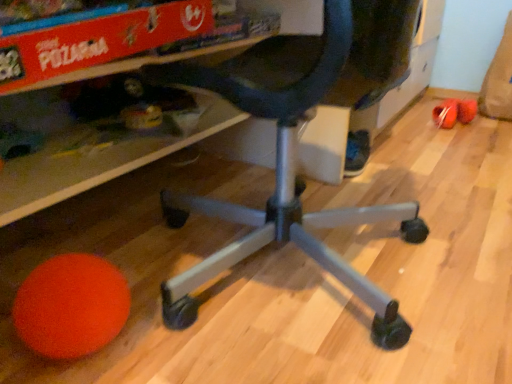
Question: From a real-world perspective, is orange matte ball at lower left above or below rubberized plastic ball at lower left?

Choices:
 (A) above
 (B) below

Answer: (A)

Question: Do you think orange matte ball at lower left is within rubberized plastic ball at lower left, or outside of it?

Choices:
 (A) outside
 (B) inside

Answer: (A)

Question: Which is nearer to the orange matte ball at lower left?

Choices:
 (A) rubberized plastic ball at lower left
 (B) black matte office chair at center

Answer: (B)

Question: Which of these objects is positioned closest to the black matte office chair at center?

Choices:
 (A) rubberized plastic ball at lower left
 (B) orange matte ball at lower left

Answer: (B)